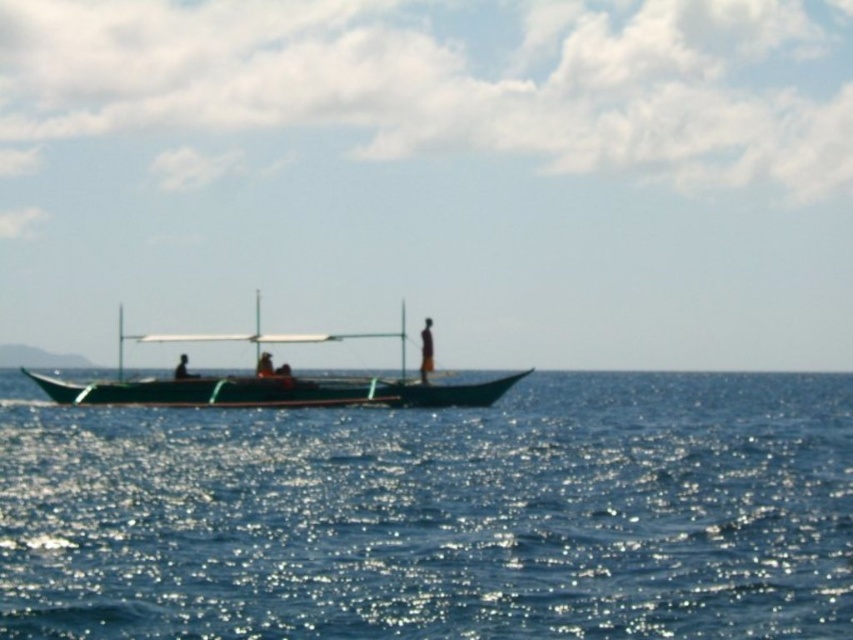
You are an observer on the boat and see the blue water at center and the orange fabric person at center. Which object is taller?

The orange fabric person at center is taller than the blue water at center.

You are a marine biologist observing two boats in the water. You need to determine which boat is wider. The green matte boat at center and the dark brown wooden boat at center are both in view. Which one has a greater width?

The green matte boat at center has a greater width than the dark brown wooden boat at center according to the description.

You are standing on the deck of the boat and see the blue water at center and the dark brown wooden person at center. Which object is located lower in the scene?

The blue water at center is located below the dark brown wooden person at center, so the blue water at center is lower in the scene.